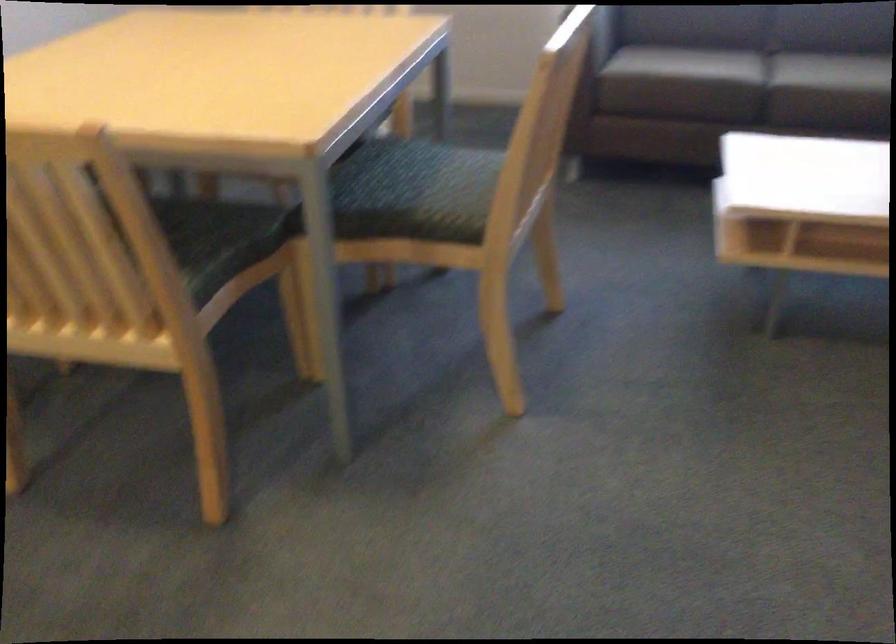
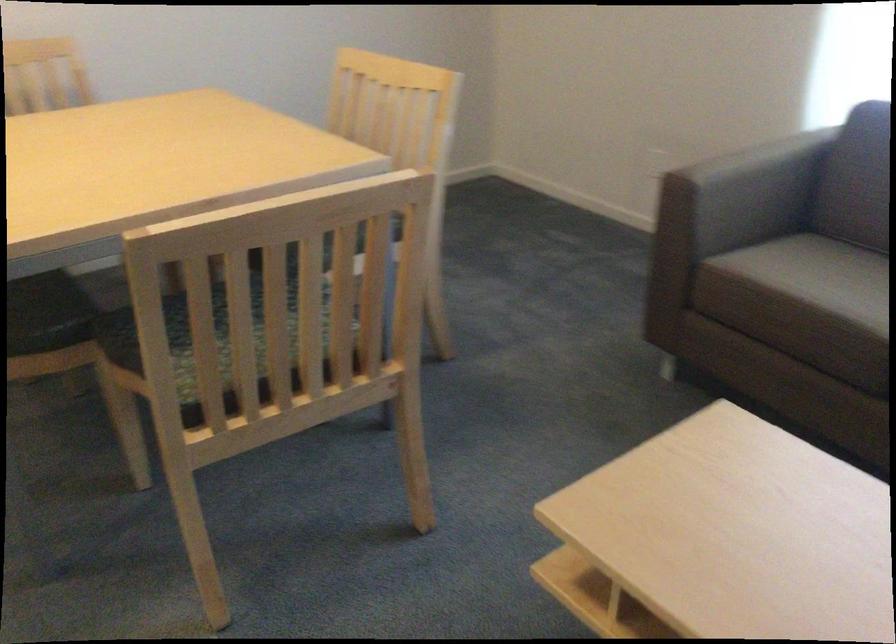
The point at [250,221] is marked in the first image. Where is the corresponding point in the second image?

(47, 313)